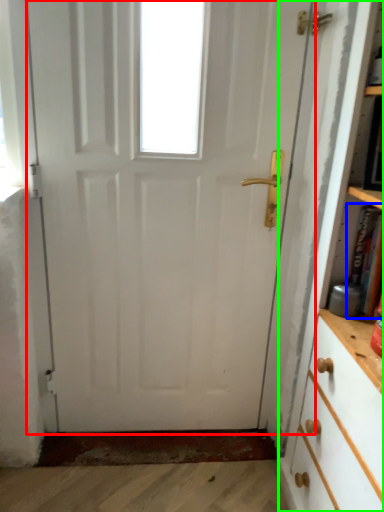
Question: Based on their relative distances, which object is nearer to door (highlighted by a red box)? Choose from book (highlighted by a blue box) and bookcase (highlighted by a green box).

Choices:
 (A) book
 (B) bookcase

Answer: (B)